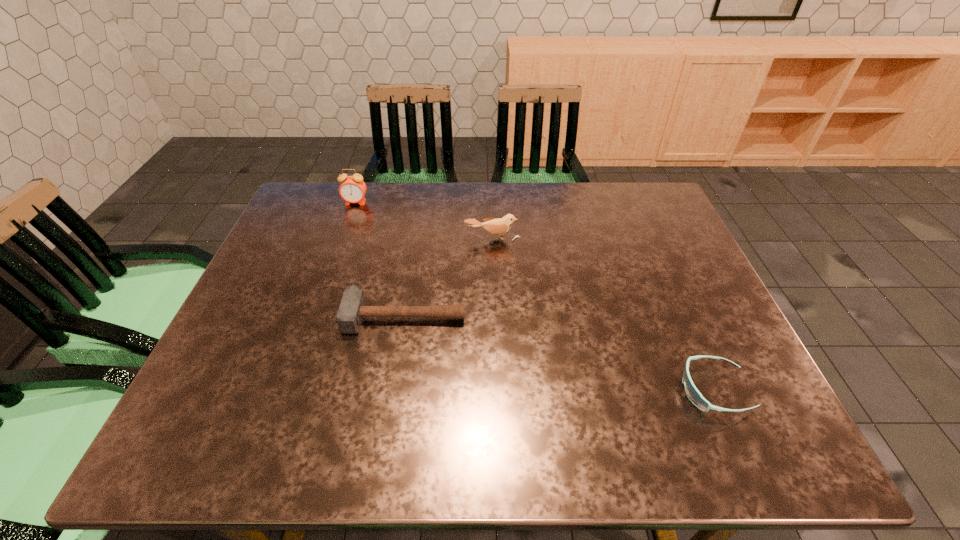
You are a GUI agent. You are given a task and a screenshot of the screen. Output one action in this format:
    pyautogui.click(x=<x>, y=<y>)
    Task: Click on the vacant space at the near edge
    The width and height of the screenshot is (960, 540).
    Given the screenshot: What is the action you would take?
    pyautogui.click(x=294, y=418)

This screenshot has height=540, width=960. Find the location of `free location at the left edge`. free location at the left edge is located at coordinates (217, 400).

I want to click on free space at the right edge of the desktop, so click(x=667, y=274).

You are a GUI agent. You are given a task and a screenshot of the screen. Output one action in this format:
    pyautogui.click(x=<x>, y=<y>)
    Task: Click on the vacant area at the near left corner
    
    Given the screenshot: What is the action you would take?
    pyautogui.click(x=233, y=434)

In the image, there is a desktop. Where is `vacant space at the far right corner`? The width and height of the screenshot is (960, 540). vacant space at the far right corner is located at coordinates (618, 188).

Where is `free spot between the third farthest object and the alarm clock`? free spot between the third farthest object and the alarm clock is located at coordinates (380, 259).

Where is `free spot between the second nearest object and the bird`? free spot between the second nearest object and the bird is located at coordinates (448, 276).

Locate an element on the screen. The height and width of the screenshot is (540, 960). vacant area between the hammer and the third shortest object is located at coordinates (448, 276).

You are a GUI agent. You are given a task and a screenshot of the screen. Output one action in this format:
    pyautogui.click(x=<x>, y=<y>)
    Task: Click on the free area in between the goggles and the hammer
    
    Given the screenshot: What is the action you would take?
    pyautogui.click(x=559, y=353)

Find the location of `empty location between the rightmost object and the bird`. empty location between the rightmost object and the bird is located at coordinates (603, 314).